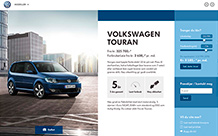
Where is `windows`? The width and height of the screenshot is (218, 136). windows is located at coordinates (19, 65), (30, 68), (46, 67).